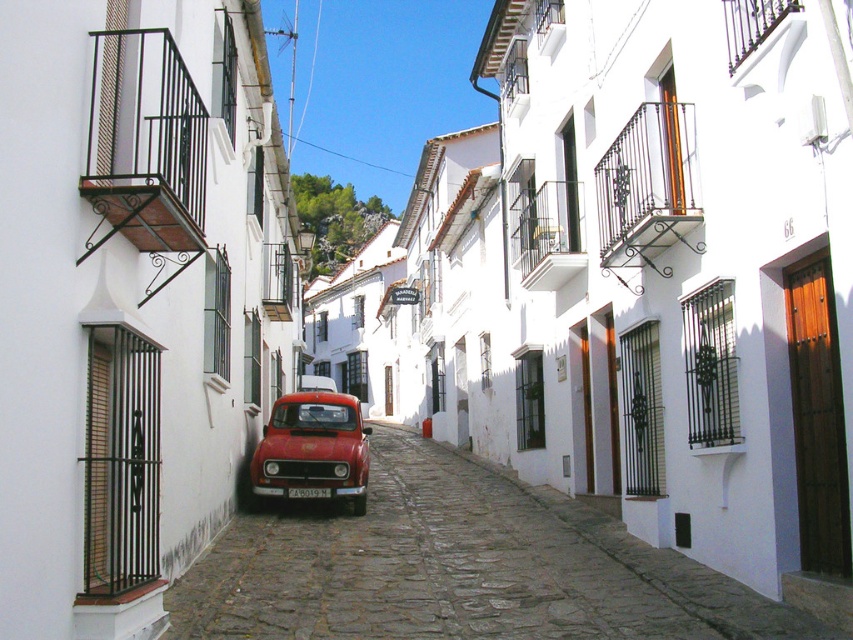
Question: Observing the image, what is the correct spatial positioning of matte red car at center in reference to white plastic license plate at center?

Choices:
 (A) left
 (B) right

Answer: (B)

Question: Does matte red car at center have a larger size compared to white plastic license plate at center?

Choices:
 (A) yes
 (B) no

Answer: (A)

Question: Is metallic red car at center further to camera compared to matte red car at center?

Choices:
 (A) yes
 (B) no

Answer: (B)

Question: Which is nearer to the matte red car at center?

Choices:
 (A) white plastic license plate at center
 (B) metallic red car at center

Answer: (A)

Question: Estimate the real-world distances between objects in this image. Which object is farther from the white plastic license plate at center?

Choices:
 (A) matte red car at center
 (B) metallic red car at center

Answer: (B)

Question: Which object is positioned closest to the metallic red car at center?

Choices:
 (A) matte red car at center
 (B) white plastic license plate at center

Answer: (B)